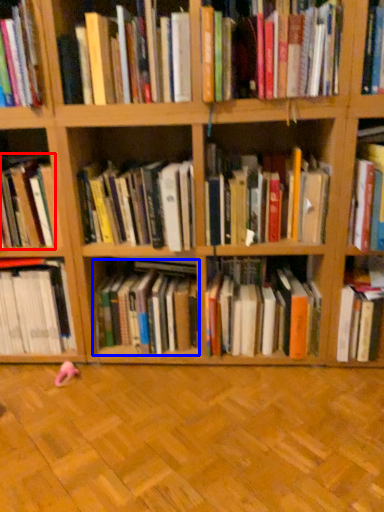
Question: Which object is further to the camera taking this photo, book (highlighted by a red box) or book (highlighted by a blue box)?

Choices:
 (A) book
 (B) book

Answer: (B)